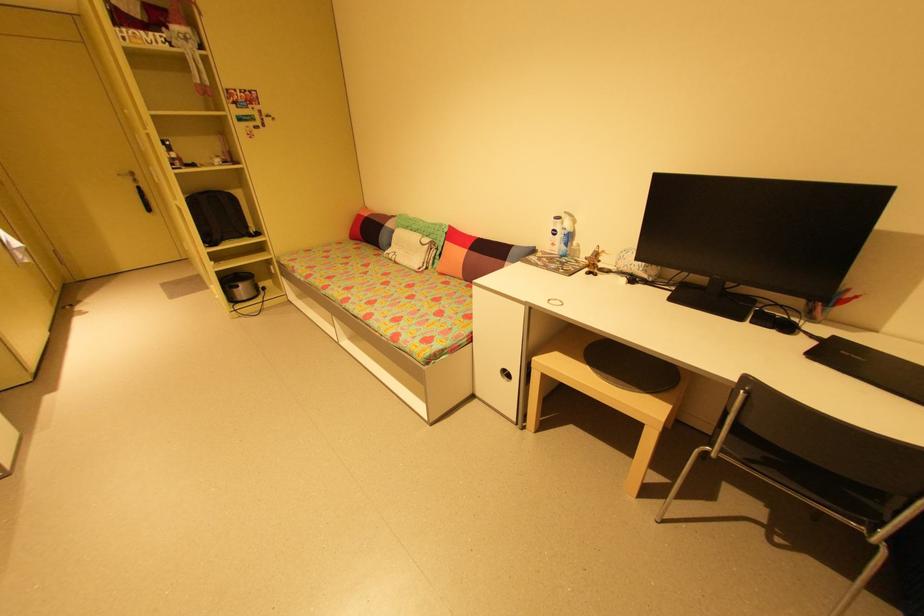
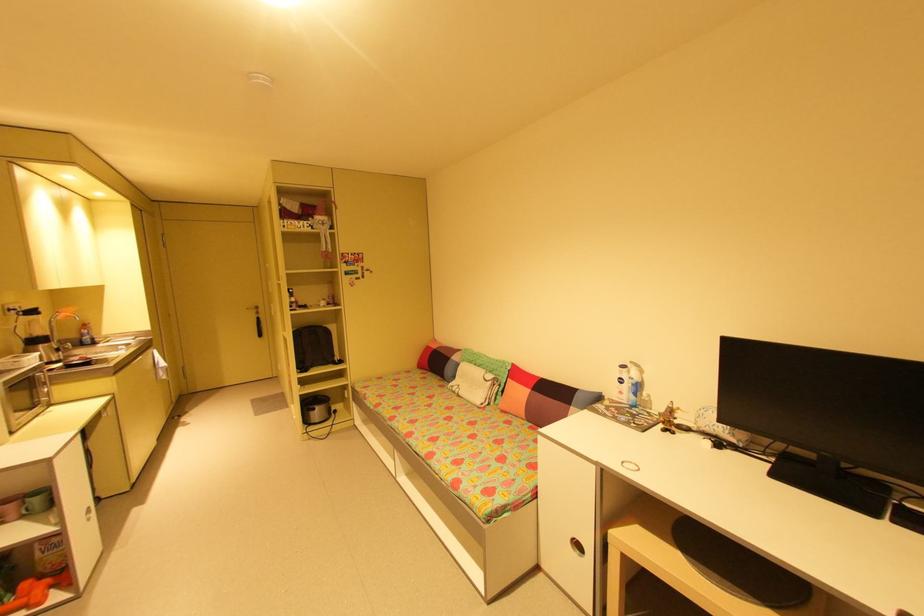
Question: The images are taken continuously from a first-person perspective. In which direction is your viewpoint rotating?

Choices:
 (A) Left
 (B) Right
 (C) Up
 (D) Down

Answer: (C)